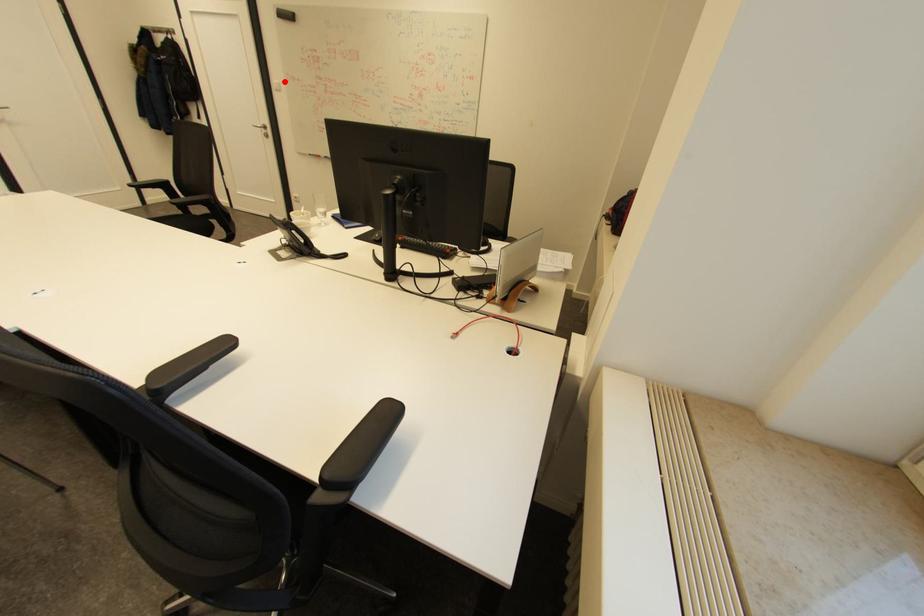
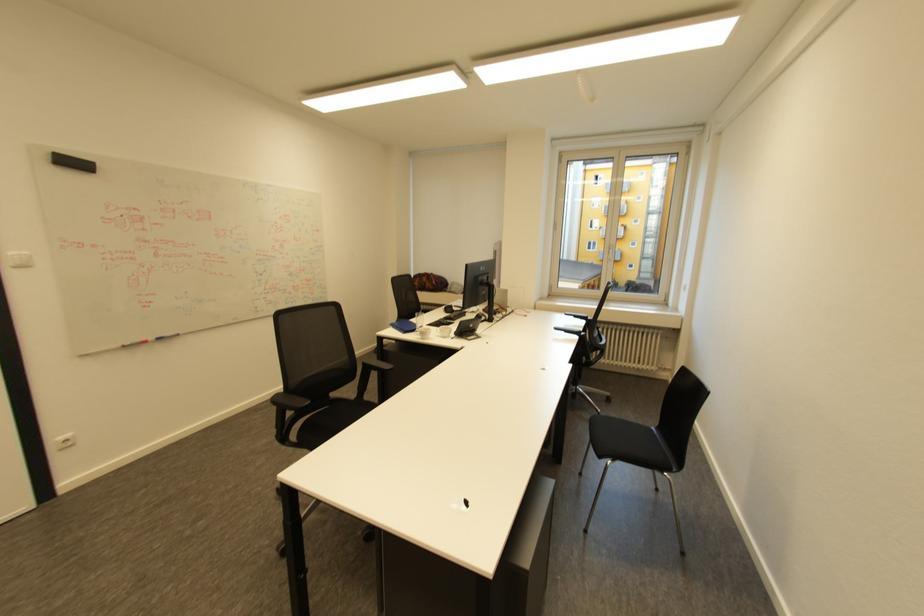
Find the pixel in the second image that matches the highlighted location in the first image.

(30, 253)